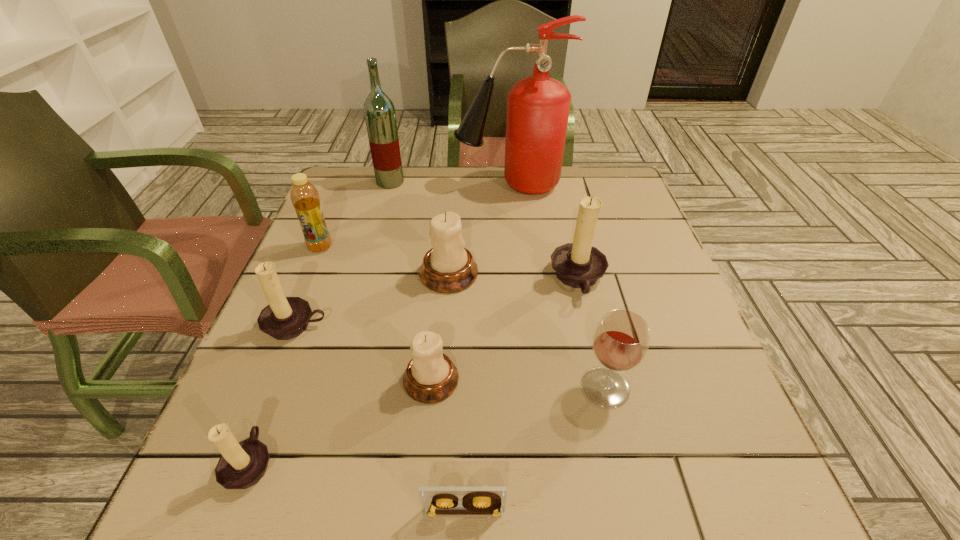
This screenshot has height=540, width=960. I want to click on vacant region located 0.390m on the front of the green liquor, so click(362, 284).

Find the location of a particular element. Image resolution: width=960 pixels, height=540 pixels. blank area located on the wick of the tallest candle holder is located at coordinates (444, 279).

The height and width of the screenshot is (540, 960). Identify the location of vacant region located on the wick of the tallest candle holder. (470, 279).

Locate an element on the screen. vacant area situated on the wick of the tallest candle holder is located at coordinates (435, 279).

Locate an element on the screen. Image resolution: width=960 pixels, height=540 pixels. vacant space positioned on the right of the bottle is located at coordinates (435, 247).

Image resolution: width=960 pixels, height=540 pixels. Identify the location of free space located on the back of the bigger white candle holder. (455, 191).

Identify the location of vacant region located on the wick of the second farthest brown candle holder. The width and height of the screenshot is (960, 540). (265, 404).

I want to click on vacant space located 0.300m on the left of the wineglass, so click(413, 387).

Image resolution: width=960 pixels, height=540 pixels. I want to click on free space located 0.300m on the left of the fourth farthest candle holder, so click(x=237, y=380).

Find the location of a particular element. Image resolution: width=960 pixels, height=540 pixels. blank space located 0.180m on the wick of the smallest brown candle holder is located at coordinates (390, 463).